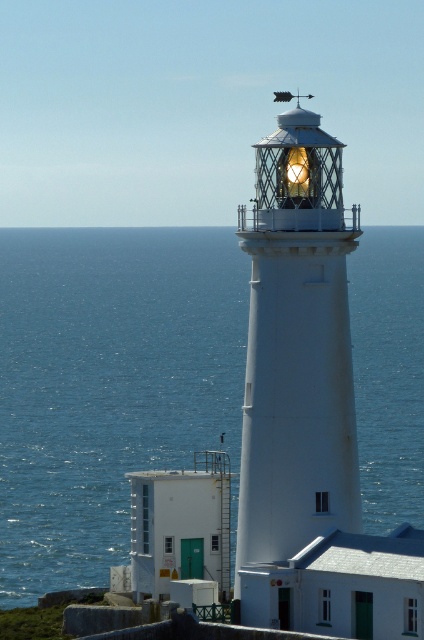
Between blue water at center and matte glass lighthouse at center, which one is positioned lower?

blue water at center is below.

Measure the distance between blue water at center and camera.

227.90 feet

This screenshot has width=424, height=640. What are the coordinates of `blue water at center` in the screenshot? It's located at (108, 385).

In the scene shown: Is blue water at center bigger than white textured lighthouse at center?

Yes, blue water at center is bigger than white textured lighthouse at center.

Describe the element at coordinates (108, 385) in the screenshot. I see `blue water at center` at that location.

In order to click on blue water at center in this screenshot , I will do `click(108, 385)`.

Who is higher up, white textured lighthouse at center or matte glass lighthouse at center?

matte glass lighthouse at center

Who is taller, white textured lighthouse at center or matte glass lighthouse at center?

Standing taller between the two is white textured lighthouse at center.

Who is more forward, (345, 330) or (292, 154)?

Point (292, 154) is more forward.

This screenshot has width=424, height=640. What are the coordinates of `white textured lighthouse at center` in the screenshot? It's located at tap(296, 349).